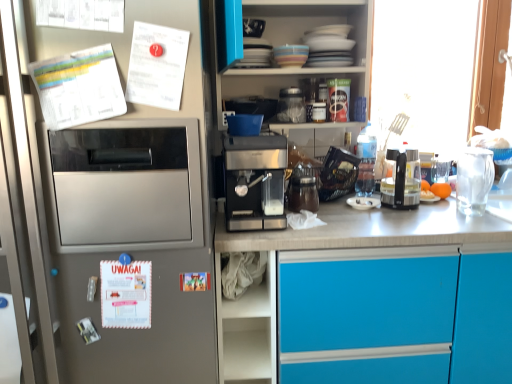
Question: In which direction should I rotate to look at metallic silver coffee machine at upper center, which ranks as the second appliance in top-to-bottom order?

Choices:
 (A) right
 (B) left

Answer: (A)

Question: Can you confirm if sleek metallic espresso machine at center is bigger than satin silver refrigerator at left?

Choices:
 (A) no
 (B) yes

Answer: (A)

Question: From the image's perspective, does sleek metallic espresso machine at center appear higher than satin silver refrigerator at left?

Choices:
 (A) yes
 (B) no

Answer: (A)

Question: Is sleek metallic espresso machine at center oriented away from satin silver refrigerator at left?

Choices:
 (A) no
 (B) yes

Answer: (A)

Question: Is sleek metallic espresso machine at center placed right next to satin silver refrigerator at left?

Choices:
 (A) yes
 (B) no

Answer: (B)

Question: Is sleek metallic espresso machine at center positioned beyond the bounds of satin silver refrigerator at left?

Choices:
 (A) no
 (B) yes

Answer: (B)

Question: Considering the relative positions of sleek metallic espresso machine at center and satin silver refrigerator at left in the image provided, is sleek metallic espresso machine at center in front of satin silver refrigerator at left?

Choices:
 (A) yes
 (B) no

Answer: (B)

Question: Can you confirm if white paper at left, the 1th postcard when ordered from bottom to top, is smaller than transparent glass window at right?

Choices:
 (A) yes
 (B) no

Answer: (A)

Question: From a real-world perspective, is white paper at left, the 1th postcard when ordered from bottom to top, physically below transparent glass window at right?

Choices:
 (A) yes
 (B) no

Answer: (A)

Question: From the image's perspective, is white paper at left, the 1th postcard when ordered from bottom to top, located beneath transparent glass window at right?

Choices:
 (A) yes
 (B) no

Answer: (A)

Question: Is white paper at left, which is counted as the 3th postcard, starting from the top, closer to the viewer compared to transparent glass window at right?

Choices:
 (A) yes
 (B) no

Answer: (A)

Question: Considering the relative sizes of white paper at left, which is counted as the 3th postcard, starting from the top, and transparent glass window at right in the image provided, is white paper at left, which is counted as the 3th postcard, starting from the top, thinner than transparent glass window at right?

Choices:
 (A) no
 (B) yes

Answer: (B)

Question: Is transparent glass window at right located within white paper at left, which is counted as the 3th postcard, starting from the top?

Choices:
 (A) yes
 (B) no

Answer: (B)

Question: From the image's perspective, is white fabric at lower center beneath satin silver refrigerator at left?

Choices:
 (A) yes
 (B) no

Answer: (A)